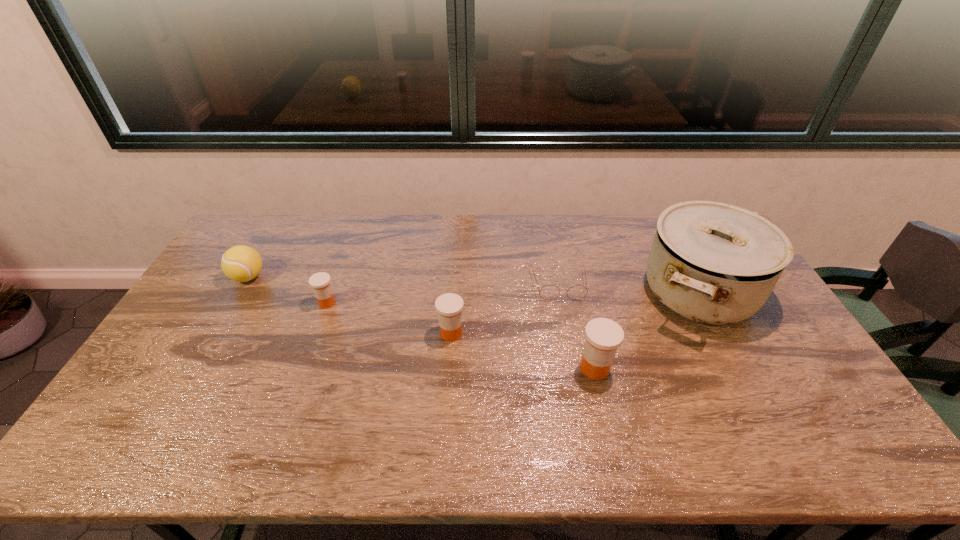
The height and width of the screenshot is (540, 960). What are the coordinates of `free space between the second tallest medicine and the spectacles` in the screenshot? It's located at (505, 309).

Find the location of `vacant space in between the leftmost medicine and the second medicine from right to left`. vacant space in between the leftmost medicine and the second medicine from right to left is located at coordinates (389, 318).

Locate an element on the screen. The width and height of the screenshot is (960, 540). empty location between the third object from left to right and the tennis ball is located at coordinates (349, 305).

The width and height of the screenshot is (960, 540). Identify the location of unoccupied area between the leftmost object and the second farthest medicine. [349, 305].

Locate an element on the screen. This screenshot has height=540, width=960. vacant region between the tallest object and the shortest object is located at coordinates (629, 288).

Identify the location of free point between the leftmost object and the second medicine from left to right. (349, 305).

I want to click on blank region between the second farthest medicine and the leftmost object, so (x=349, y=305).

I want to click on free spot between the rightmost object and the shortest object, so click(629, 288).

The height and width of the screenshot is (540, 960). I want to click on the second closest object relative to the fifth shortest object, so click(549, 292).

This screenshot has width=960, height=540. I want to click on object that is the second closest one to the nearest medicine, so click(549, 292).